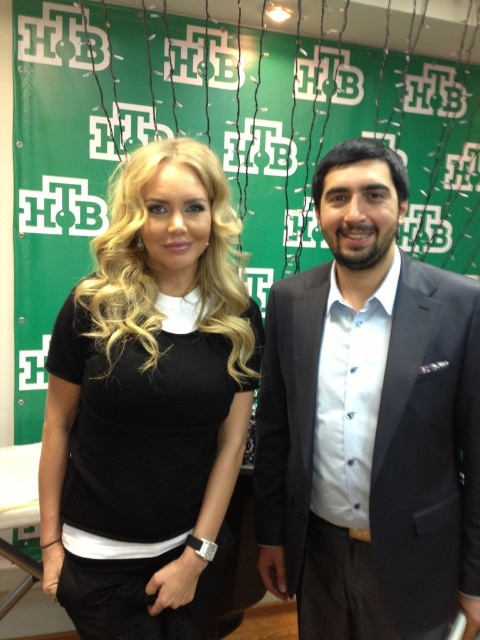
Question: Considering the real-world distances, which object is farthest from the green fabric bulletin board at upper center?

Choices:
 (A) black matte t-shirt at center
 (B) dark gray suit at center

Answer: (B)

Question: Is green fabric bulletin board at upper center above black matte t-shirt at center?

Choices:
 (A) yes
 (B) no

Answer: (A)

Question: Observing the image, what is the correct spatial positioning of green fabric bulletin board at upper center in reference to dark gray suit at center?

Choices:
 (A) below
 (B) above

Answer: (B)

Question: Is dark gray suit at center further to the viewer compared to black matte t-shirt at center?

Choices:
 (A) no
 (B) yes

Answer: (B)

Question: Which object is closer to the camera taking this photo?

Choices:
 (A) dark gray suit at center
 (B) black matte t-shirt at center
 (C) green fabric bulletin board at upper center

Answer: (B)

Question: Which object is farther from the camera taking this photo?

Choices:
 (A) green fabric bulletin board at upper center
 (B) dark gray suit at center
 (C) black matte t-shirt at center

Answer: (A)